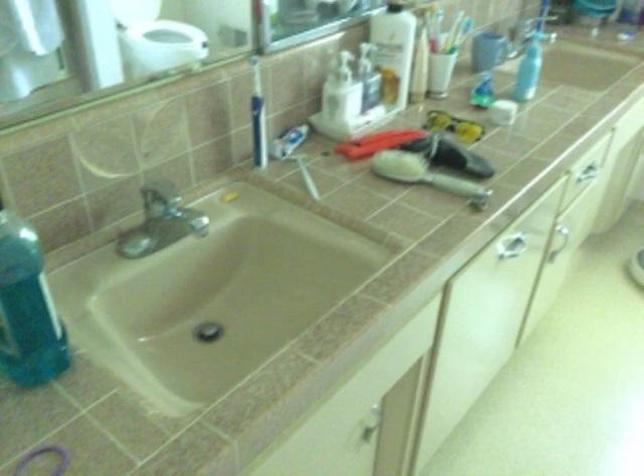
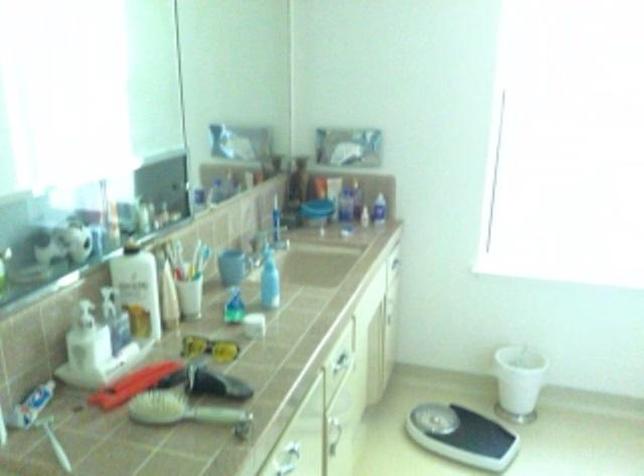
The first image is from the beginning of the video and the second image is from the end. How did the camera likely rotate when shooting the video?

The rotation direction of the camera is right-up.